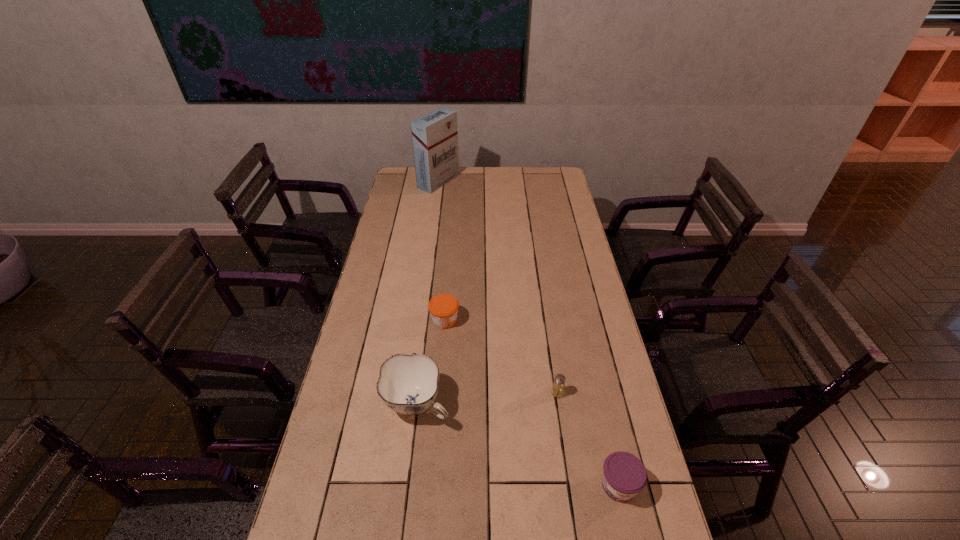
This screenshot has width=960, height=540. In order to click on jam object that ranks as the second closest to the chinaware in this screenshot , I will do `click(624, 475)`.